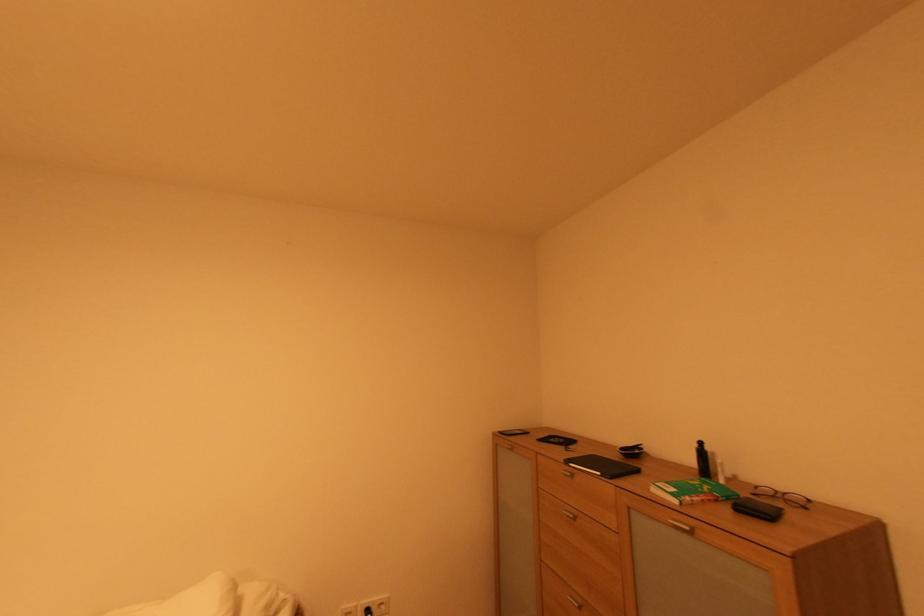
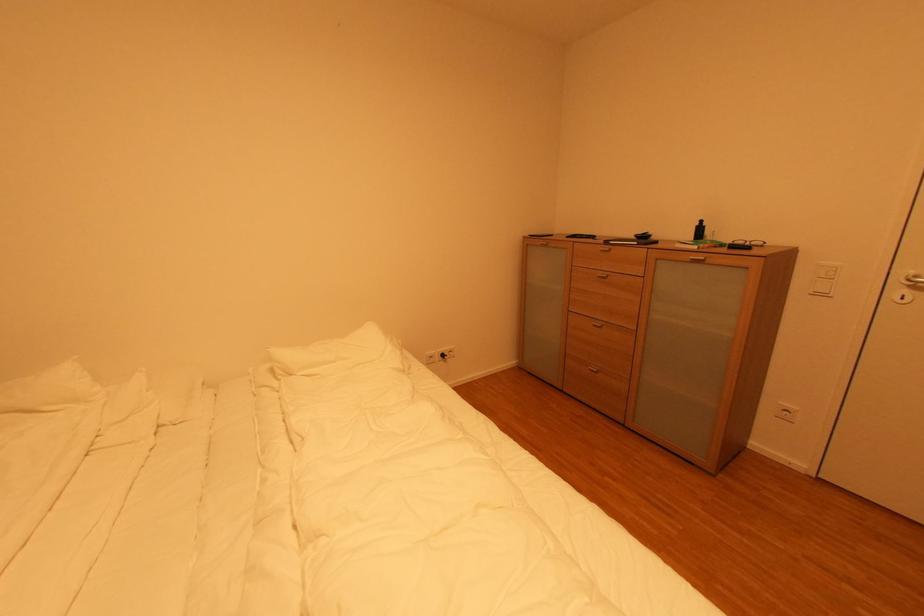
What movement of the cameraman would produce the second image?

The movement direction of the cameraman is left, backward.